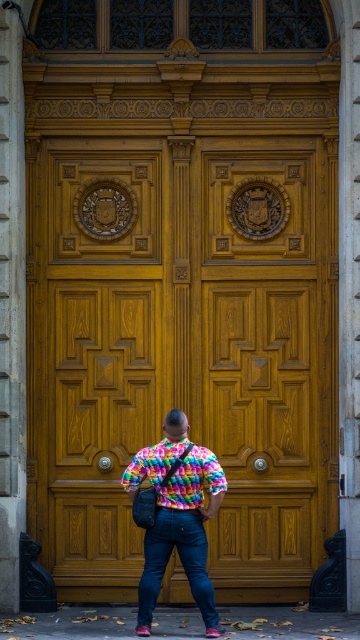
You are a security guard observing the scene. You need to determine if the wooden door at center is positioned higher than the multicolored fabric shirt at center. Based on the spatial arrangement in the image, what is your conclusion?

The wooden door at center is above the multicolored fabric shirt at center, so the door is positioned higher than the shirt.

You are a photographer trying to capture the ornate wooden door in the image. The multicolored fabric shirt at center is blocking your view. Can you estimate how far to the right or left you need to move to avoid the shirt?

The multicolored fabric shirt at center is positioned at point 0.839 on the horizontal axis. To avoid it, move to the left side of the frame since the shirt is closer to the right edge.